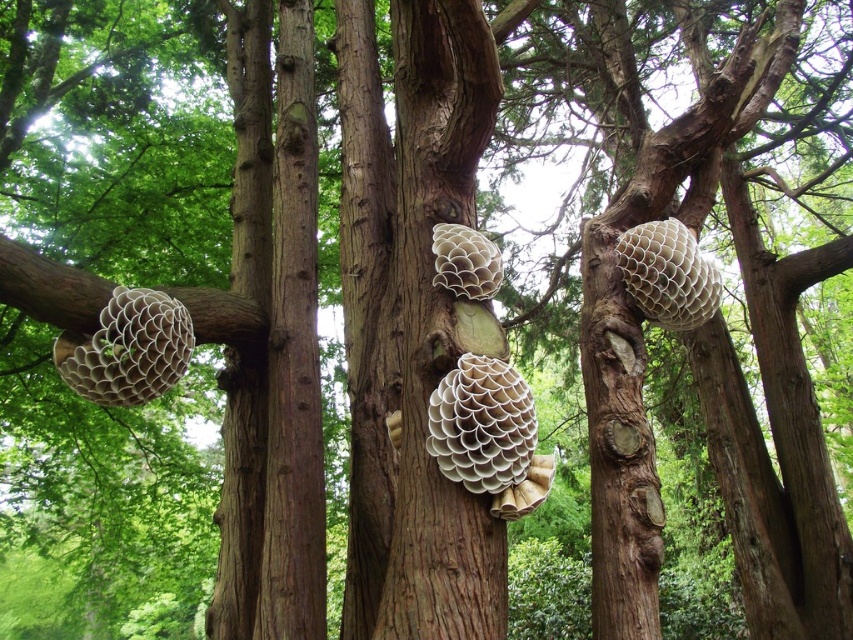
Does brown rough tree trunk at center appear under white honeycomb beehive at upper right?

Actually, brown rough tree trunk at center is above white honeycomb beehive at upper right.

Which is in front, point (364, 493) or point (669, 237)?

Point (669, 237) is more forward.

Is point (491, 44) positioned after point (679, 310)?

No, (491, 44) is in front of (679, 310).

The width and height of the screenshot is (853, 640). Identify the location of brown rough tree trunk at center. (410, 320).

Which of these two, white textured beehive at center or white honeycomb beehive at center, stands shorter?

white honeycomb beehive at center is shorter.

Between white textured beehive at center and white honeycomb beehive at center, which one is positioned higher?

white honeycomb beehive at center is higher up.

Between point (474, 365) and point (442, 225), which one is positioned in front?

Point (474, 365)

At what (x,y) coordinates should I click in order to perform the action: click on white textured beehive at center. Please return your answer as a coordinate pair (x, y). The image size is (853, 640). Looking at the image, I should click on (482, 424).

Describe the element at coordinates (410, 320) in the screenshot. The image size is (853, 640). I see `brown rough tree trunk at center` at that location.

Which is behind, point (345, 179) or point (495, 410)?

Point (345, 179)

At what (x,y) coordinates should I click in order to perform the action: click on brown rough tree trunk at center. Please return your answer as a coordinate pair (x, y). Looking at the image, I should click on pyautogui.click(x=410, y=320).